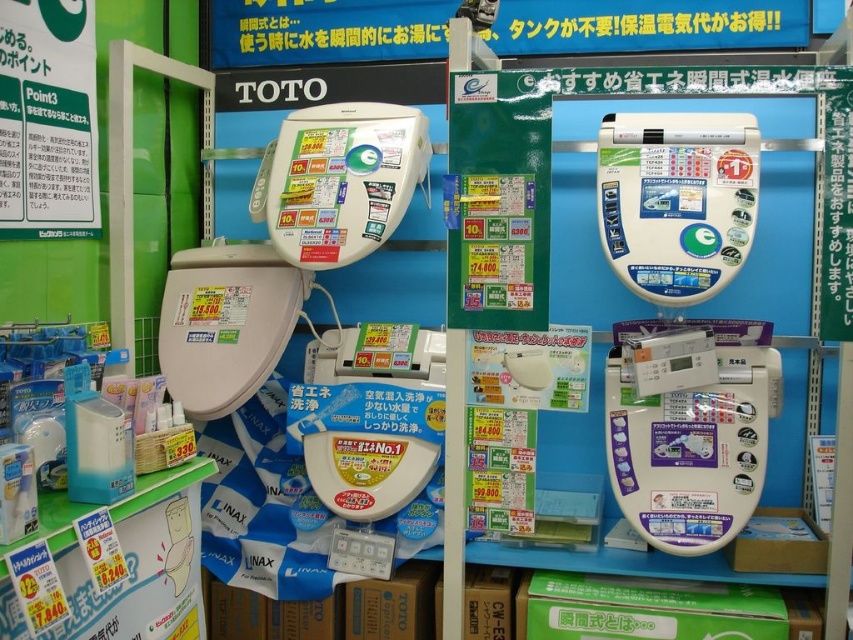
You are a customer in the store and want to place a small decorative item on the white glossy toilet seat at center. Can you fit it there considering the space compared to the white plastic shelf at lower left?

The white glossy toilet seat at center occupies less space than the white plastic shelf at lower left. Therefore, the decorative item may fit, but it depends on the size of the item relative to the seat.

Consider the image. You are a customer in the store and want to reach the control panel of the matte white toilet at center. The white plastic shelf at lower left is blocking your path. Can you move around the shelf to access the control panel?

The white plastic shelf at lower left is in front of the matte white toilet at center, so you can move around the shelf to access the control panel by going to either side of the shelf.

You are a customer in the store and want to place a small brochure on the white plastic shelf at lower left. Can you confirm the exact coordinates of the shelf to ensure proper placement?

The white plastic shelf at lower left is located at point [123,564], so you can place the brochure there accurately.